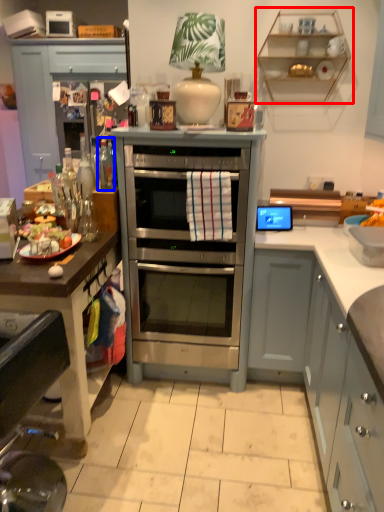
Question: Which of the following is the farthest to the observer, shelf (highlighted by a red box) or bottle (highlighted by a blue box)?

Choices:
 (A) shelf
 (B) bottle

Answer: (A)